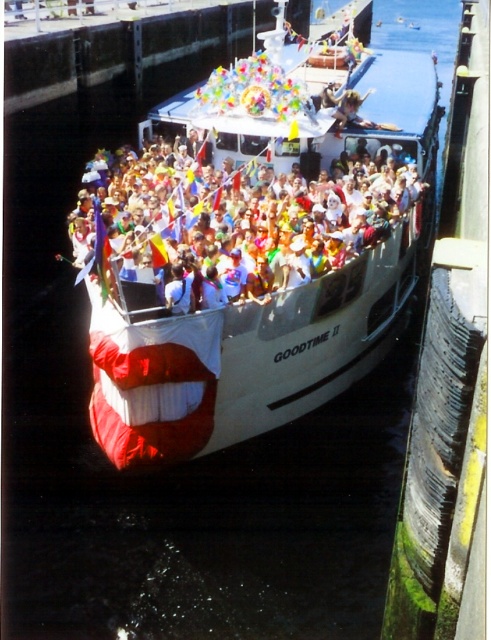
You are standing on the dock and looking at the white matte boat at center and the multicolored fabric crowd at center. Which object is positioned higher from the ground?

The white matte boat at center is positioned higher than the multicolored fabric crowd at center because it is located above them.

Based on the scene description, which object occupies a larger area in the image? Please choose between the white matte boat at center and the multicolored fabric crowd at center.

The white matte boat at center is bigger than the multicolored fabric crowd at center.

You are a photographer standing on the dock, and you want to take a picture of the white matte boat at center and the multicolored fabric crowd at center. Since the boat is wider than the crowd, which object should you focus on to ensure both are in the frame without cropping?

You should focus on the white matte boat at center because it is wider than the multicolored fabric crowd at center, so centering the boat will ensure both are included in the frame.